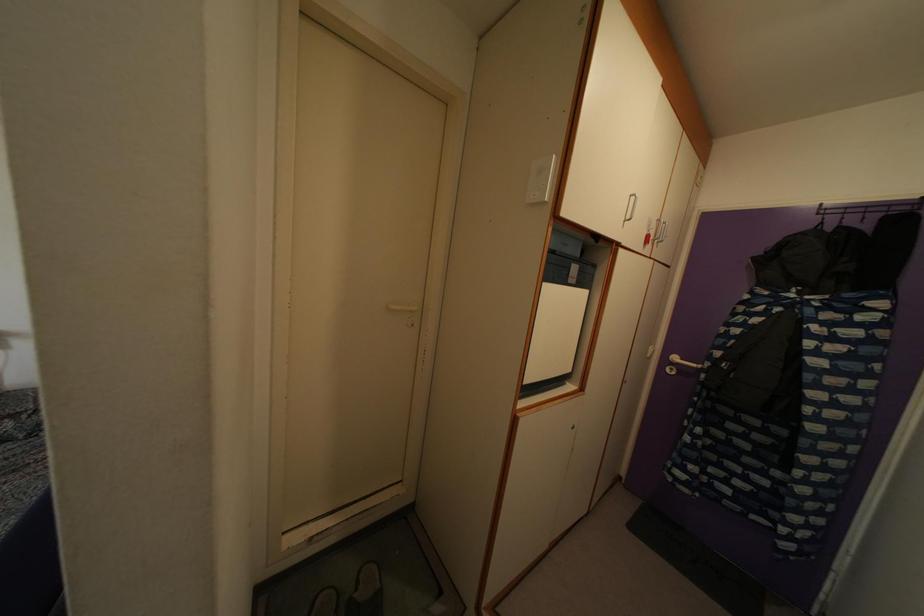
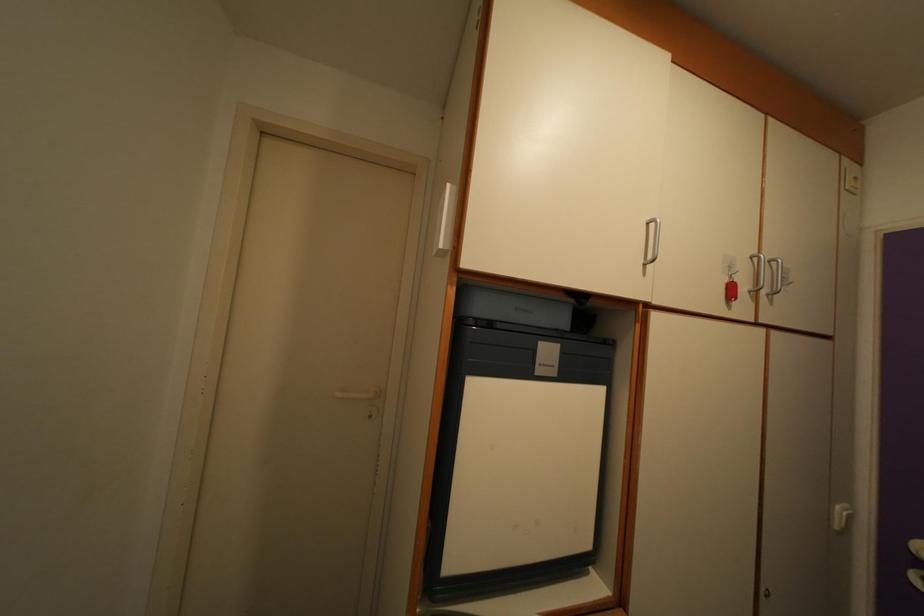
Where in the second image is the point corresponding to [636,206] from the first image?

(654, 233)